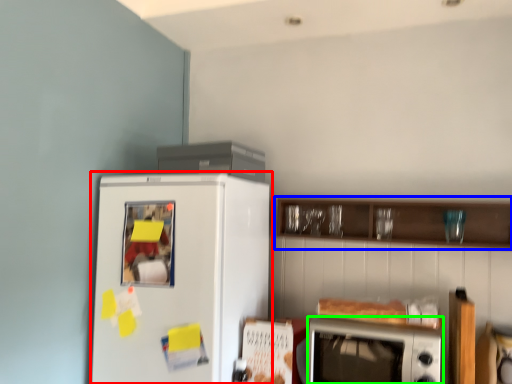
Question: Which object is positioned closest to refrigerator (highlighted by a red box)? Select from cabinetry (highlighted by a blue box) and microwave oven (highlighted by a green box).

Choices:
 (A) cabinetry
 (B) microwave oven

Answer: (B)